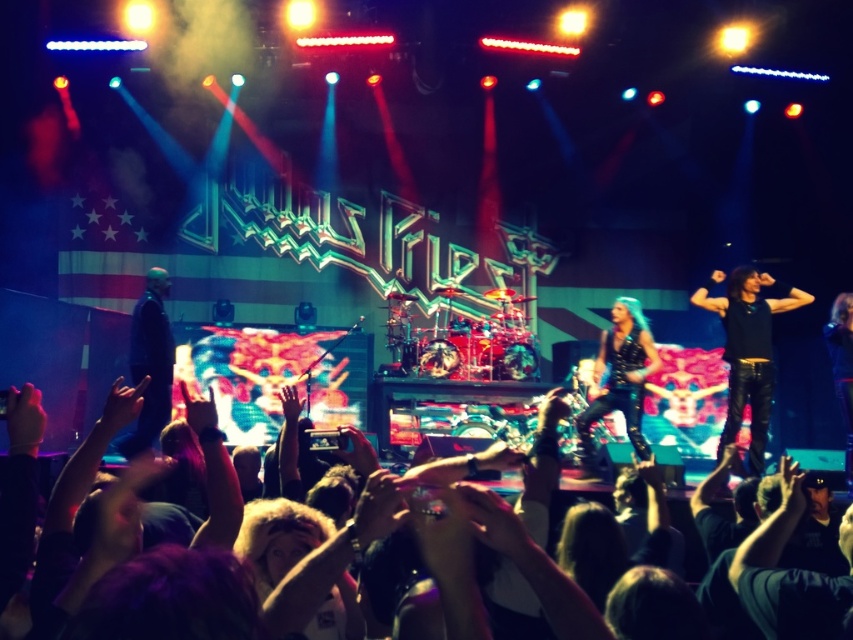
Question: Can you confirm if black leather pants at right is positioned below black leather jacket at left?

Choices:
 (A) no
 (B) yes

Answer: (A)

Question: Which object appears farthest from the camera in this image?

Choices:
 (A) black leather pants at right
 (B) black leather jacket at left

Answer: (A)

Question: Considering the relative positions of black leather pants at right and black leather jacket at left in the image provided, where is black leather pants at right located with respect to black leather jacket at left?

Choices:
 (A) right
 (B) left

Answer: (A)

Question: Which of the following is the closest to the observer?

Choices:
 (A) black leather pants at right
 (B) black leather jacket at left

Answer: (B)

Question: Among these points, which one is nearest to the camera?

Choices:
 (A) (157, 364)
 (B) (706, 305)

Answer: (A)

Question: Is black leather pants at right bigger than black leather jacket at left?

Choices:
 (A) yes
 (B) no

Answer: (B)